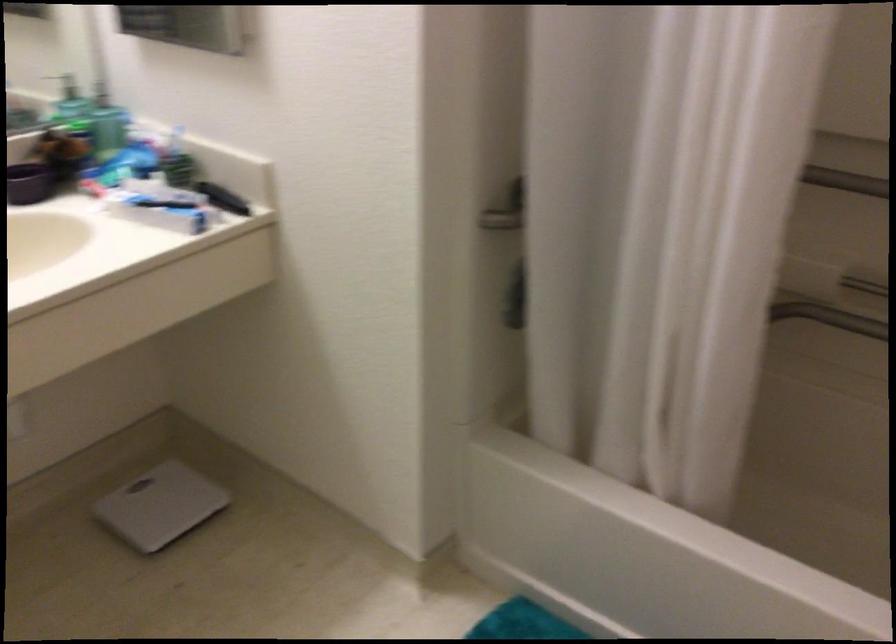
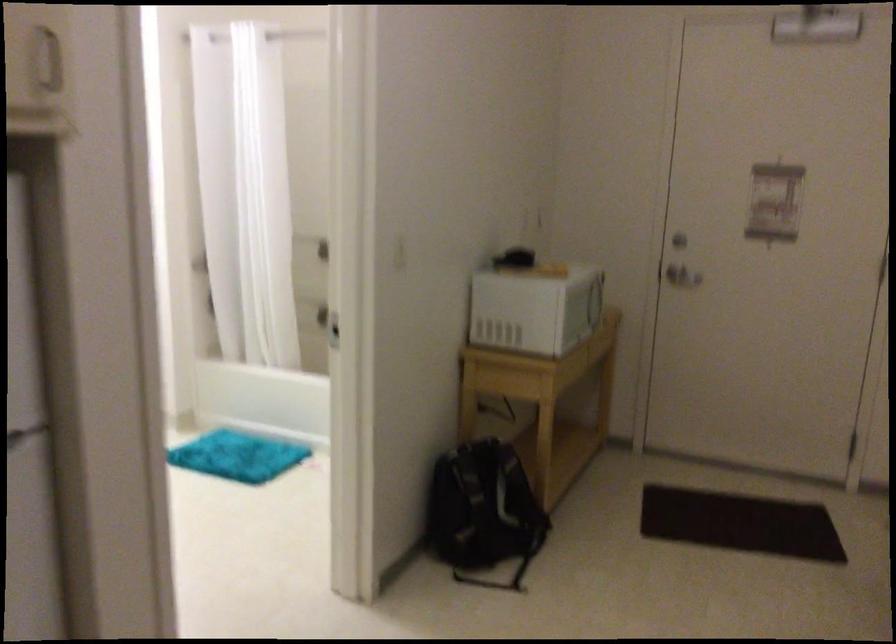
Question: Which direction would the cameraman need to move to produce the second image? Reply with the corresponding letter.

Choices:
 (A) Left
 (B) Right
 (C) Forward
 (D) Backward

Answer: (D)